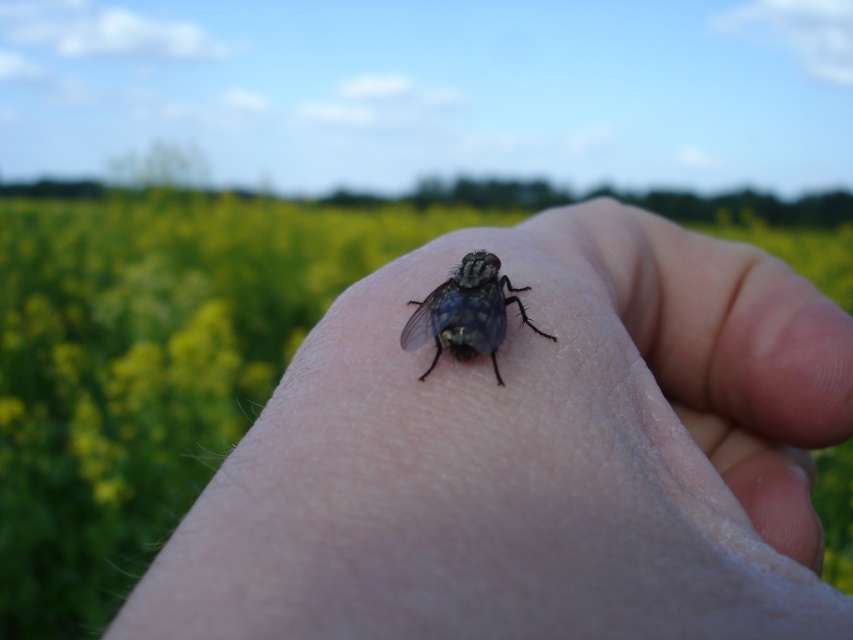
Question: Can you confirm if smooth skin hand at center is thinner than shiny metallic fly at center?

Choices:
 (A) no
 (B) yes

Answer: (A)

Question: Is smooth skin hand at center to the right of shiny metallic fly at center from the viewer's perspective?

Choices:
 (A) no
 (B) yes

Answer: (B)

Question: Observing the image, what is the correct spatial positioning of smooth skin hand at center in reference to shiny metallic fly at center?

Choices:
 (A) left
 (B) right

Answer: (B)

Question: Which of the following is the farthest from the observer?

Choices:
 (A) shiny metallic fly at center
 (B) smooth skin hand at center

Answer: (A)

Question: Which of the following is the closest to the observer?

Choices:
 (A) shiny metallic fly at center
 (B) smooth skin hand at center

Answer: (B)